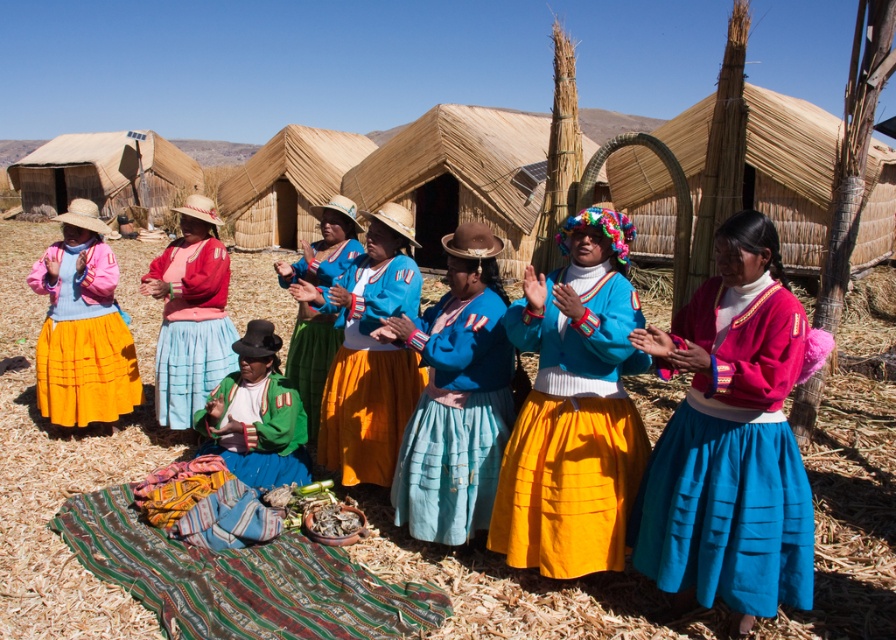
You are a photographer trying to capture the group of women in the scene. Where should you position yourself to ensure the brown dirt field at center is in the center of your photo?

→ The brown dirt field at center is already positioned at point (65, 460), so to center it in your photo, you should position yourself so that the camera is aligned with those coordinates.

You are a fashion designer observing the women in the scene. You need to determine which item of clothing is more suitable for a cold day based on their thickness. Which one would you choose between the matte blue sweater at center and the blue cotton blouse at center?

The matte blue sweater at center is thinner than the blue cotton blouse at center, so the blue cotton blouse at center is thicker and more suitable for a cold day.

You are a photographer trying to capture the women in the scene. You want to ensure both the matte blue sweater at center and the blue cotton blouse at center are visible in your shot. Which one should you focus on first to frame them properly?

The matte blue sweater at center is to the right of the blue cotton blouse at center, so you should focus on the blue cotton blouse at center first to frame them properly from left to right.